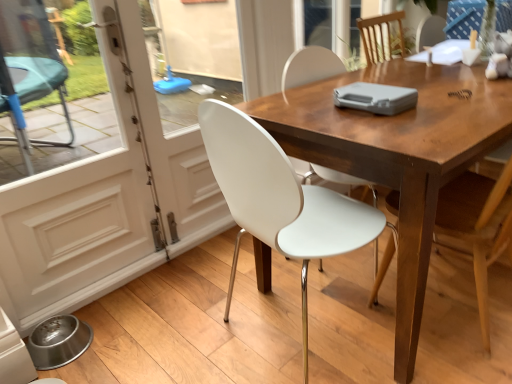
Question: Do you think wooden table at center is within wooden chair at center, the second chair from the left, or outside of it?

Choices:
 (A) outside
 (B) inside

Answer: (A)

Question: From a real-world perspective, is wooden table at center physically located above or below wooden chair at center, the 1th chair from the right?

Choices:
 (A) below
 (B) above

Answer: (A)

Question: Estimate the real-world distances between objects in this image. Which object is closer to the white glossy screen door at left, marked as the 1th screen door in a right-to-left arrangement?

Choices:
 (A) wooden chair at center, the 1th chair from the right
 (B) wooden table at center
 (C) white plastic chair at center, marked as the second chair in a right-to-left arrangement
 (D) white glossy screen door at left, which appears as the 2th screen door when viewed from the right

Answer: (D)

Question: Considering the real-world distances, which object is farthest from the wooden chair at center, the 1th chair from the right?

Choices:
 (A) white glossy screen door at left, which appears as the 2th screen door when viewed from the right
 (B) white glossy screen door at left, marked as the 1th screen door in a right-to-left arrangement
 (C) white plastic chair at center, positioned as the first chair in left-to-right order
 (D) wooden table at center

Answer: (B)